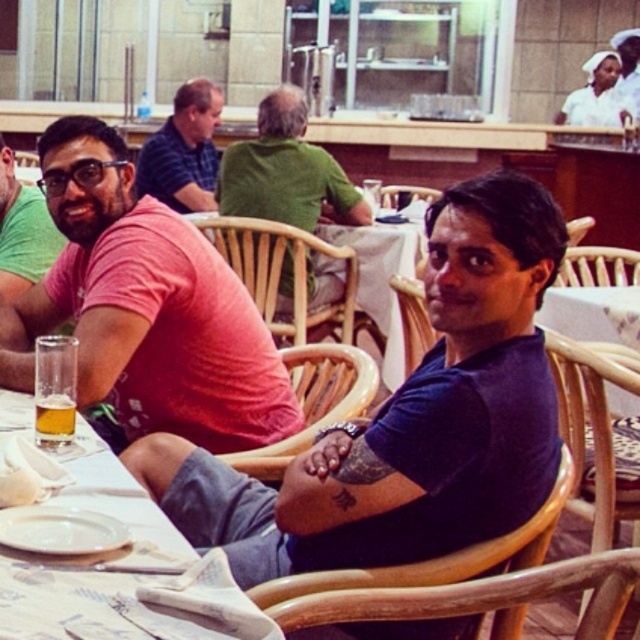
Between point (49, 596) and point (189, 83), which one is positioned in front?

Point (49, 596) is more forward.

Does clear glass at lower left have a lesser width compared to striped polo shirt at center?

No, clear glass at lower left is not thinner than striped polo shirt at center.

Where is `clear glass at lower left`? The image size is (640, 640). clear glass at lower left is located at coordinates tap(113, 570).

Who is shorter, clear glass at lower left or matte black shirt at left?

clear glass at lower left

Image resolution: width=640 pixels, height=640 pixels. What do you see at coordinates (113, 570) in the screenshot?
I see `clear glass at lower left` at bounding box center [113, 570].

At what (x,y) coordinates should I click in order to perform the action: click on clear glass at lower left. Please return your answer as a coordinate pair (x, y). Looking at the image, I should click on (113, 570).

Can you confirm if pink matte shirt at center is bigger than clear glass at lower left?

Yes, pink matte shirt at center is bigger than clear glass at lower left.

Measure the distance between point (x=144, y=282) and camera.

Point (x=144, y=282) is 2.24 meters from camera.

Who is more distant from viewer, (106, 170) or (264, 628)?

Point (106, 170)

Where is `pink matte shirt at center`? This screenshot has height=640, width=640. pink matte shirt at center is located at coordinates (145, 307).